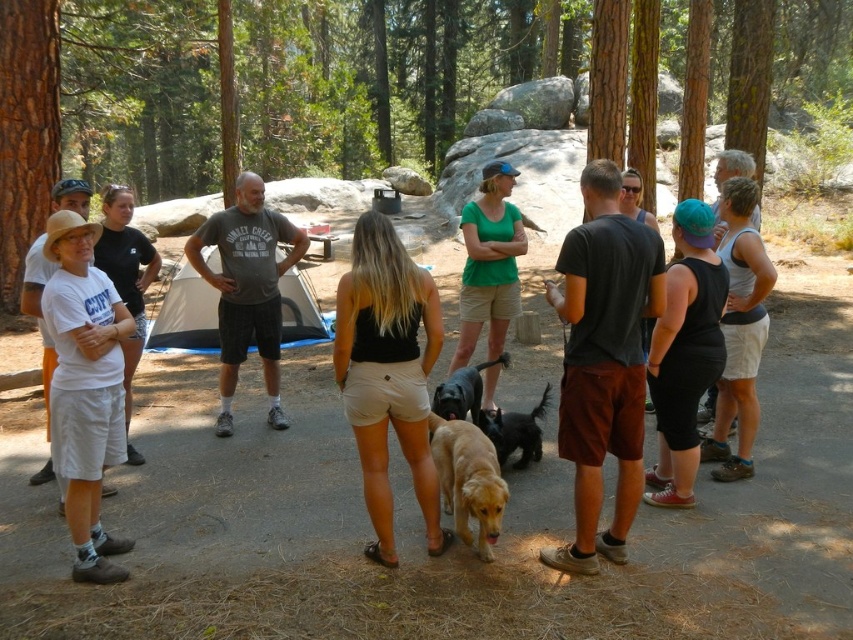
Who is positioned more to the left, golden matte dog at center or golden fur dog at center?

golden matte dog at center

Is golden matte dog at center above golden fur dog at center?

No.

What do you see at coordinates (468, 481) in the screenshot?
I see `golden matte dog at center` at bounding box center [468, 481].

Locate an element on the screen. golden matte dog at center is located at coordinates (468, 481).

Who is positioned more to the right, golden matte dog at center or shiny black dog at center?

From the viewer's perspective, shiny black dog at center appears more on the right side.

Does golden matte dog at center have a smaller size compared to shiny black dog at center?

Yes.

Is point (474, 429) closer to viewer compared to point (444, 396)?

Yes, point (474, 429) is in front of point (444, 396).

Where is `golden matte dog at center`? golden matte dog at center is located at coordinates (468, 481).

Is golden fur dog at center to the left of shiny black dog at center from the viewer's perspective?

In fact, golden fur dog at center is to the right of shiny black dog at center.

Is golden fur dog at center taller than shiny black dog at center?

Correct, golden fur dog at center is much taller as shiny black dog at center.

Is point (495, 420) farther from viewer compared to point (496, 364)?

No, it is in front of (496, 364).

The width and height of the screenshot is (853, 640). Find the location of `golden fur dog at center`. golden fur dog at center is located at coordinates (515, 432).